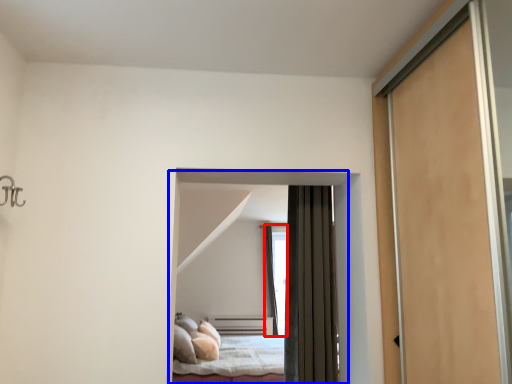
Question: Which point is closer to the camera, window (highlighted by a red box) or bed (highlighted by a blue box)?

Choices:
 (A) window
 (B) bed

Answer: (B)